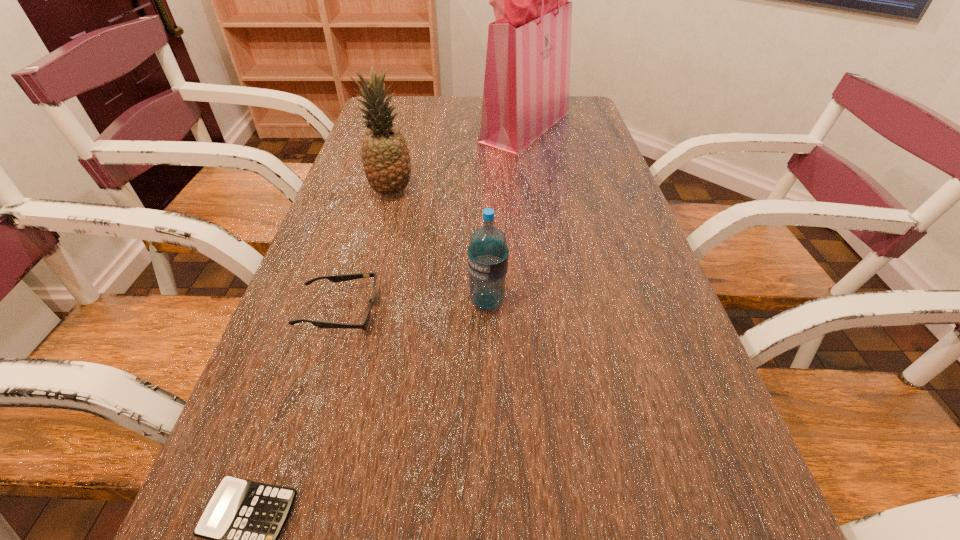
You are a GUI agent. You are given a task and a screenshot of the screen. Output one action in this format:
    pyautogui.click(x=<x>, y=<y>)
    Task: Click on the object that is positioned at the far edge
    Image resolution: width=960 pixels, height=540 pixels.
    Given the screenshot: What is the action you would take?
    pyautogui.click(x=527, y=75)

Find the location of `pineapple located at the left edge`. pineapple located at the left edge is located at coordinates (385, 156).

At what (x,y) coordinates should I click in order to perform the action: click on sunglasses present at the left edge. Please return your answer as a coordinate pair (x, y). This screenshot has width=960, height=540. Looking at the image, I should click on coord(344,277).

The image size is (960, 540). Identify the location of object that is at the right edge. tap(527, 75).

I want to click on object that is at the far right corner, so click(x=527, y=75).

In order to click on vacant area at the far edge of the desktop in this screenshot , I will do `click(457, 104)`.

At what (x,y) coordinates should I click in order to perform the action: click on vacant space at the left edge of the desktop. Please return your answer as a coordinate pair (x, y). The height and width of the screenshot is (540, 960). Looking at the image, I should click on (359, 147).

You are a GUI agent. You are given a task and a screenshot of the screen. Output one action in this format:
    pyautogui.click(x=<x>, y=<y>)
    Task: Click on the vacant area at the right edge of the desktop
    The height and width of the screenshot is (540, 960).
    Given the screenshot: What is the action you would take?
    pyautogui.click(x=583, y=139)

In the image, there is a desktop. Identify the location of free space at the far left corner. (386, 99).

This screenshot has width=960, height=540. I want to click on vacant region at the far right corner, so click(564, 124).